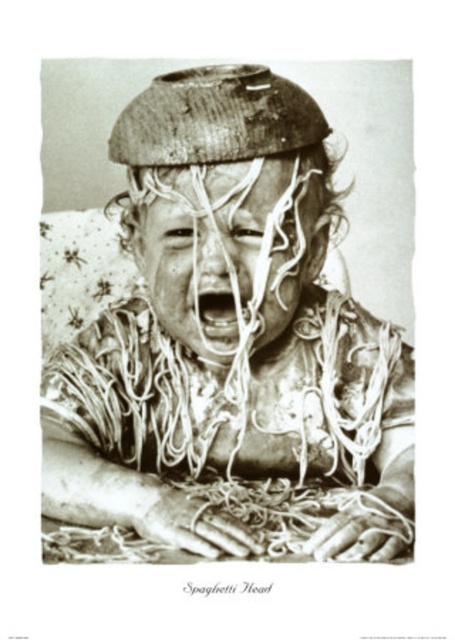
Question: Does wooden bowl at upper center have a greater width compared to smooth white noodles at center?

Choices:
 (A) yes
 (B) no

Answer: (A)

Question: Which object is closer to the camera taking this photo?

Choices:
 (A) smooth white noodles at center
 (B) wooden bowl at upper center

Answer: (B)

Question: Is wooden bowl at upper center smaller than smooth white noodles at center?

Choices:
 (A) yes
 (B) no

Answer: (B)

Question: Which object is closer to the camera taking this photo?

Choices:
 (A) smooth white noodles at center
 (B) wooden bowl at upper center

Answer: (B)

Question: Which point appears closest to the camera in this image?

Choices:
 (A) (333, 413)
 (B) (221, 179)

Answer: (B)

Question: Can you confirm if wooden bowl at upper center is positioned to the left of smooth white noodles at center?

Choices:
 (A) no
 (B) yes

Answer: (B)